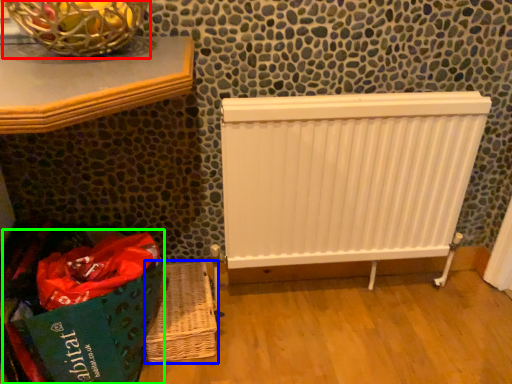
Question: Which is nearer to the basket container (highlighted by a red box)? basket (highlighted by a blue box) or shopping bag (highlighted by a green box).

Choices:
 (A) basket
 (B) shopping bag

Answer: (B)